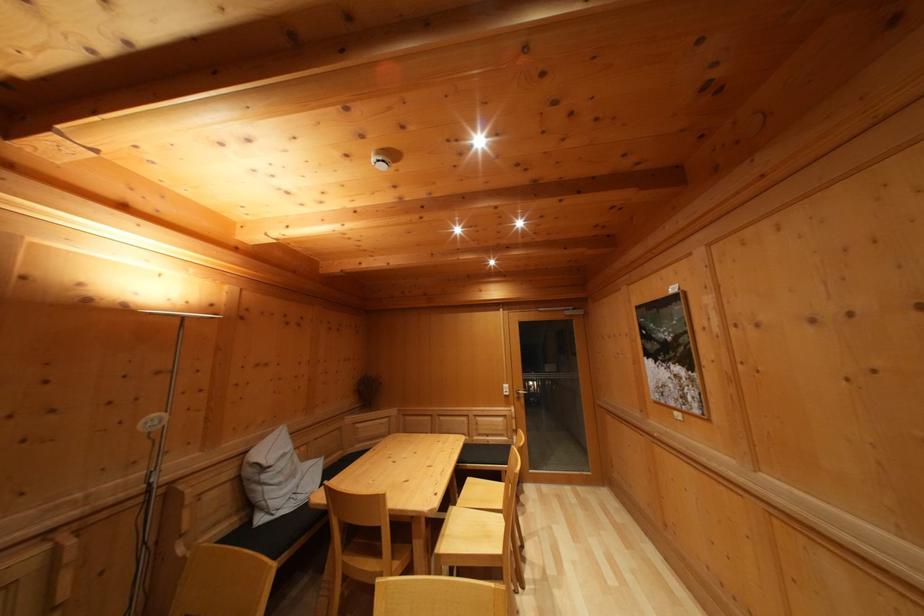
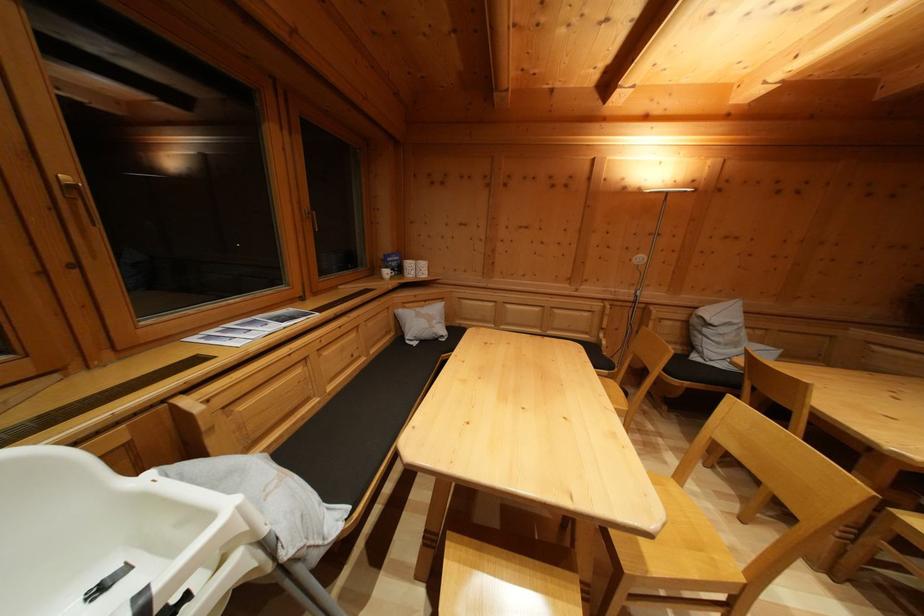
Where in the second image is the point corresponding to (x=270, y=484) from the first image?

(711, 337)